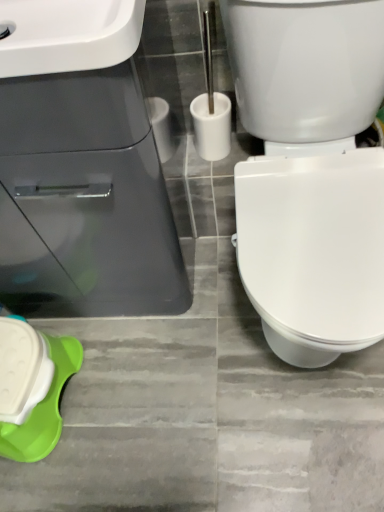
Question: From the image's perspective, is white plastic toilet brush at center located beneath white glossy sink at upper left, which is counted as the 1th sink, starting from the front?

Choices:
 (A) no
 (B) yes

Answer: (B)

Question: Is white plastic toilet brush at center not near white glossy sink at upper left, the second sink positioned from the back?

Choices:
 (A) no
 (B) yes

Answer: (A)

Question: Can you see white plastic toilet brush at center touching white glossy sink at upper left, the second sink positioned from the back?

Choices:
 (A) yes
 (B) no

Answer: (B)

Question: Is white plastic toilet brush at center not inside white glossy sink at upper left, which is counted as the 1th sink, starting from the front?

Choices:
 (A) no
 (B) yes

Answer: (B)

Question: From a real-world perspective, is white plastic toilet brush at center physically below white glossy sink at upper left, the second sink positioned from the back?

Choices:
 (A) yes
 (B) no

Answer: (A)

Question: Is white plastic toilet brush at center closer to camera compared to white glossy sink at upper left, the second sink positioned from the back?

Choices:
 (A) no
 (B) yes

Answer: (A)

Question: From a real-world perspective, does white glossy sink at upper left, which is counted as the 1th sink, starting from the front, stand above green plastic container at lower left?

Choices:
 (A) no
 (B) yes

Answer: (B)

Question: Is white glossy sink at upper left, which is counted as the 1th sink, starting from the front, turned away from green plastic container at lower left?

Choices:
 (A) yes
 (B) no

Answer: (B)

Question: Is white glossy sink at upper left, which is counted as the 1th sink, starting from the front, not close to green plastic container at lower left?

Choices:
 (A) yes
 (B) no

Answer: (B)

Question: Can you confirm if white glossy sink at upper left, the second sink positioned from the back, is taller than green plastic container at lower left?

Choices:
 (A) no
 (B) yes

Answer: (A)

Question: Does white glossy sink at upper left, which is counted as the 1th sink, starting from the front, have a greater width compared to green plastic container at lower left?

Choices:
 (A) yes
 (B) no

Answer: (A)

Question: Would you say green plastic container at lower left is part of white glossy sink at upper left, the second sink positioned from the back,'s contents?

Choices:
 (A) yes
 (B) no

Answer: (B)

Question: Is white glossy sink at upper left, which appears as the 2th sink when viewed from the front, oriented towards white plastic toilet brush at center?

Choices:
 (A) no
 (B) yes

Answer: (A)